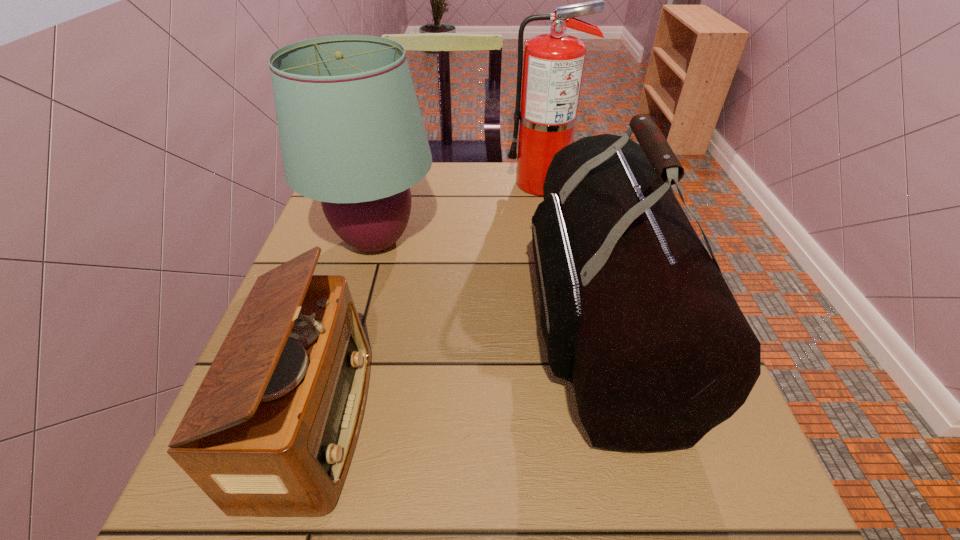
At what (x,y) coordinates should I click in order to perform the action: click on vacant region between the duffel bag and the shortest object. Please return your answer as a coordinate pair (x, y). Looking at the image, I should click on (457, 372).

Find the location of a particular element. empty location between the shortest object and the farthest object is located at coordinates (429, 302).

Locate an element on the screen. free area in between the lampshade and the farthest object is located at coordinates (459, 212).

Locate an element on the screen. the third closest object relative to the shortest object is located at coordinates (553, 64).

Locate which object is the second closest to the farthest object. Please provide its 2D coordinates. Your answer should be formatted as a tuple, i.e. [(x, y)], where the tuple contains the x and y coordinates of a point satisfying the conditions above.

[(352, 136)]